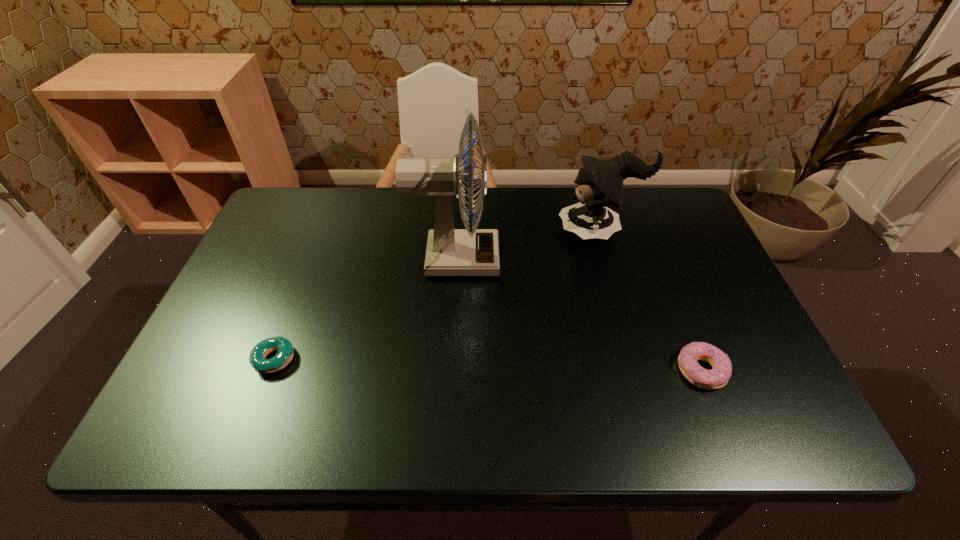
This screenshot has height=540, width=960. In order to click on vacant area located at the face of the second tallest object in this screenshot , I will do `click(427, 231)`.

At what (x,y) coordinates should I click in order to perform the action: click on free location located 0.170m on the left of the third tallest object. Please return your answer as a coordinate pair (x, y). Looking at the image, I should click on (598, 370).

You are a GUI agent. You are given a task and a screenshot of the screen. Output one action in this format:
    pyautogui.click(x=<x>, y=<y>)
    Task: Click on the free space located 0.190m on the back of the leftmost object
    
    Given the screenshot: What is the action you would take?
    pyautogui.click(x=304, y=282)

At what (x,y) coordinates should I click in order to perform the action: click on fan that is at the far edge. Please return your answer as a coordinate pair (x, y). The width and height of the screenshot is (960, 540). Looking at the image, I should click on (450, 252).

Where is `doll situated at the far edge`? This screenshot has width=960, height=540. doll situated at the far edge is located at coordinates (600, 182).

Image resolution: width=960 pixels, height=540 pixels. What are the coordinates of `object positioned at the left edge` in the screenshot? It's located at (285, 353).

The height and width of the screenshot is (540, 960). Find the location of `object situated at the right edge`. object situated at the right edge is located at coordinates (716, 378).

The height and width of the screenshot is (540, 960). I want to click on vacant space at the far edge of the desktop, so click(x=425, y=200).

At what (x,y) coordinates should I click in order to perform the action: click on vacant space at the near edge. Please return your answer as a coordinate pair (x, y). The image size is (960, 540). Looking at the image, I should click on (432, 428).

Identify the location of vacant space at the left edge of the desktop. (261, 282).